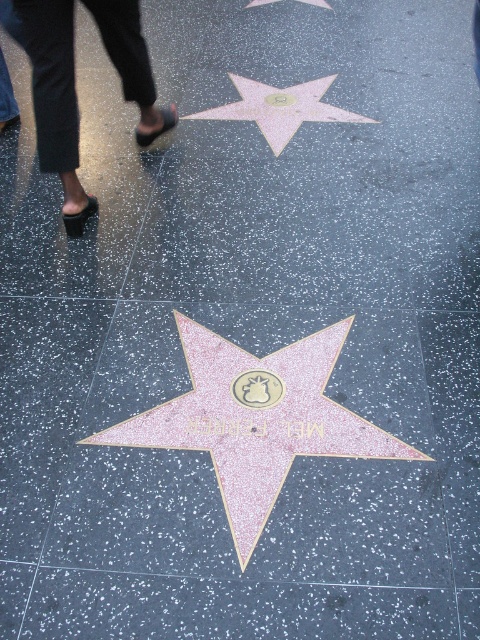
Question: In this image, where is black leather sandals at upper left located relative to pink glittery star at center?

Choices:
 (A) right
 (B) left

Answer: (B)

Question: Is black leather sandals at upper left above pink glittery star at upper center?

Choices:
 (A) yes
 (B) no

Answer: (B)

Question: Which of the following is the closest to the observer?

Choices:
 (A) pink glittery star at upper center
 (B) pink glitter star at center
 (C) black leather sandals at upper left

Answer: (B)

Question: Which object is positioned closest to the black leather sandals at upper left?

Choices:
 (A) pink glittery star at upper center
 (B) pink glittery star at center
 (C) pink glitter star at center

Answer: (A)

Question: Does black leather sandals at upper left have a smaller size compared to pink glittery star at upper center?

Choices:
 (A) yes
 (B) no

Answer: (B)

Question: Which object appears closest to the camera in this image?

Choices:
 (A) black leather sandals at upper left
 (B) pink glitter star at center

Answer: (B)